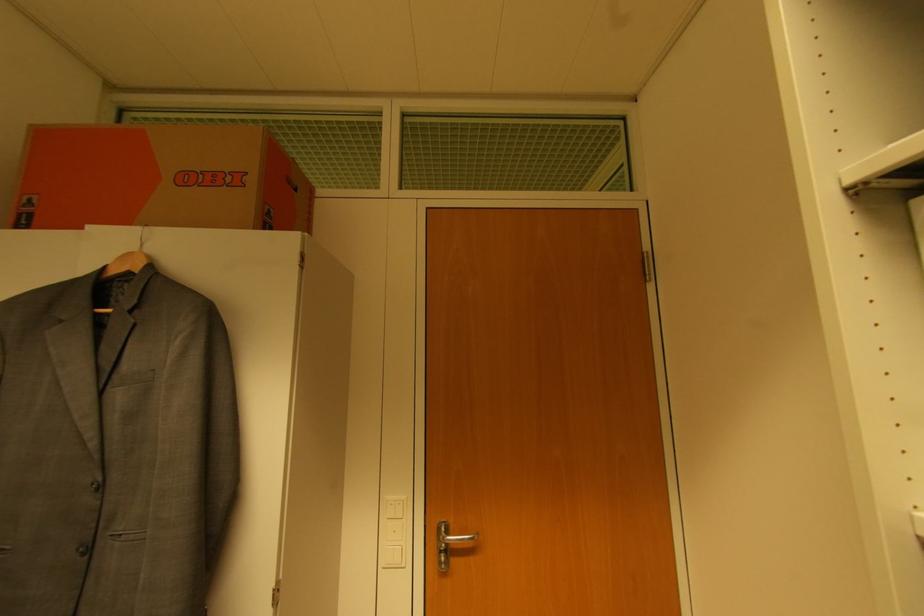
Where is `silver door handle`? The width and height of the screenshot is (924, 616). silver door handle is located at coordinates (453, 536).